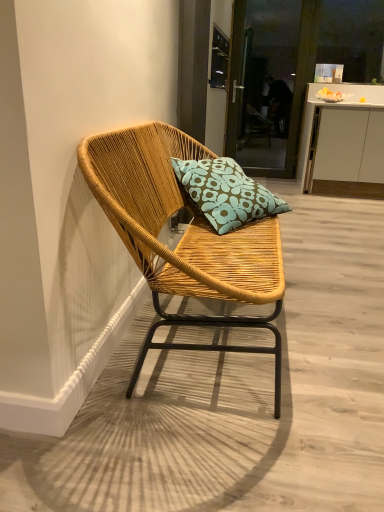
Question: Is teal floral cushion at center at the left side of woven wood chair at center?

Choices:
 (A) yes
 (B) no

Answer: (B)

Question: Is teal floral cushion at center aimed at woven wood chair at center?

Choices:
 (A) yes
 (B) no

Answer: (A)

Question: Is teal floral cushion at center positioned behind woven wood chair at center?

Choices:
 (A) no
 (B) yes

Answer: (B)

Question: Is teal floral cushion at center closer to camera compared to woven wood chair at center?

Choices:
 (A) yes
 (B) no

Answer: (B)

Question: Is teal floral cushion at center oriented away from woven wood chair at center?

Choices:
 (A) yes
 (B) no

Answer: (A)

Question: Based on their positions, is white matte cabinet at center located to the left or right of transparent glass screen door at upper center?

Choices:
 (A) left
 (B) right

Answer: (B)

Question: Do you think white matte cabinet at center is within transparent glass screen door at upper center, or outside of it?

Choices:
 (A) inside
 (B) outside

Answer: (B)

Question: Considering the positions of white matte cabinet at center and transparent glass screen door at upper center in the image, is white matte cabinet at center taller or shorter than transparent glass screen door at upper center?

Choices:
 (A) short
 (B) tall

Answer: (A)

Question: Is point (x=352, y=86) positioned closer to the camera than point (x=238, y=10)?

Choices:
 (A) closer
 (B) farther

Answer: (B)

Question: Is woven wood chair at center inside or outside of white matte cabinet at center?

Choices:
 (A) inside
 (B) outside

Answer: (B)

Question: Looking at the image, does woven wood chair at center seem bigger or smaller compared to white matte cabinet at center?

Choices:
 (A) big
 (B) small

Answer: (A)

Question: Is point (165, 262) closer or farther from the camera than point (380, 194)?

Choices:
 (A) farther
 (B) closer

Answer: (B)

Question: Considering the positions of woven wood chair at center and white matte cabinet at center in the image, is woven wood chair at center taller or shorter than white matte cabinet at center?

Choices:
 (A) short
 (B) tall

Answer: (A)

Question: Based on their sizes in the image, would you say woven wood chair at center is bigger or smaller than teal floral cushion at center?

Choices:
 (A) big
 (B) small

Answer: (A)

Question: Considering their positions, is woven wood chair at center located in front of or behind teal floral cushion at center?

Choices:
 (A) behind
 (B) front

Answer: (B)